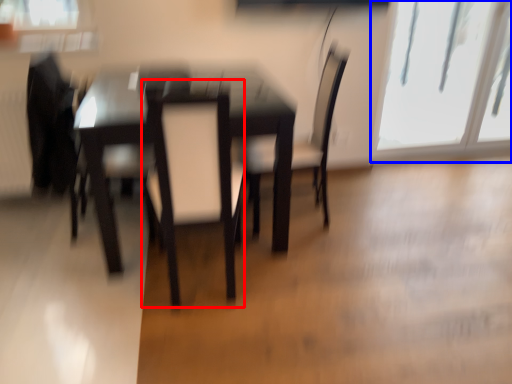
Question: Which of the following is the farthest to the observer, swivel chair (highlighted by a red box) or window (highlighted by a blue box)?

Choices:
 (A) swivel chair
 (B) window

Answer: (B)